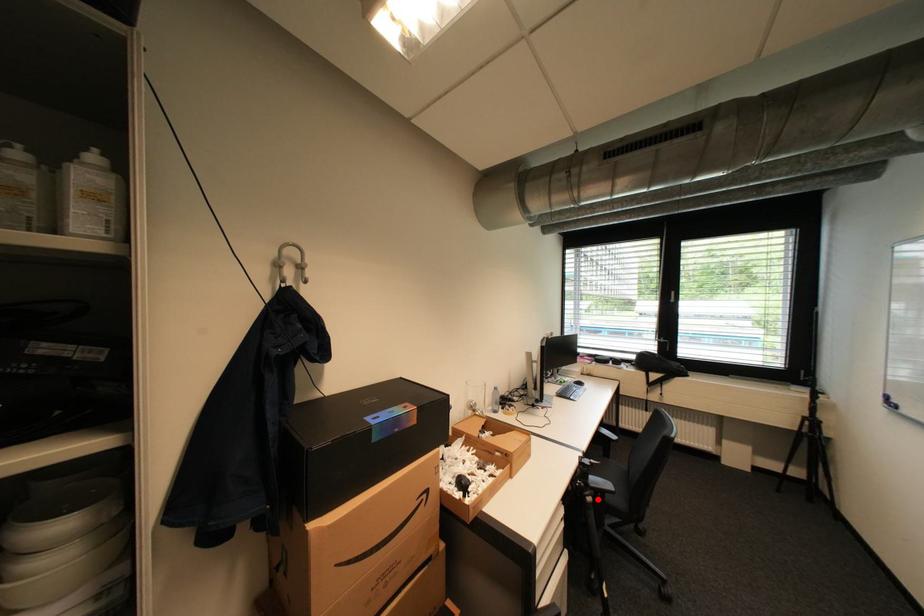
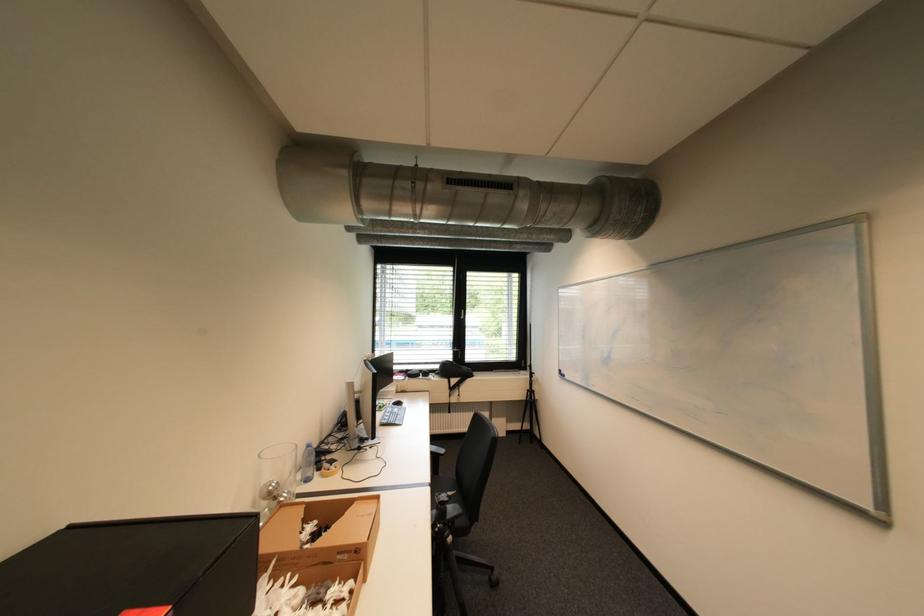
Question: I am providing you with two images of the same scene from different viewpoints. A red point is marked on the first image. At the location where the point appears in image 1, is it still visible in image 2?

Choices:
 (A) Yes
 (B) No

Answer: (A)